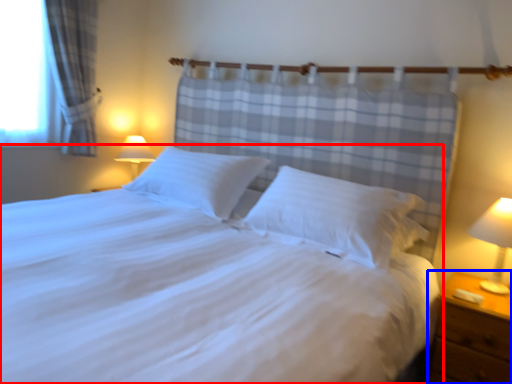
Question: Which point is further to the camera, bed (highlighted by a red box) or nightstand (highlighted by a blue box)?

Choices:
 (A) bed
 (B) nightstand

Answer: (B)